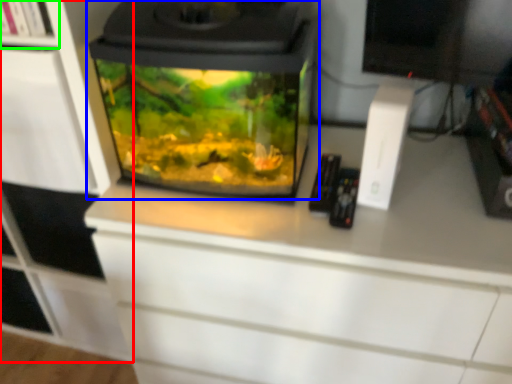
Question: Which is farther away from cabinetry (highlighted by a red box)? home appliance (highlighted by a blue box) or shelf (highlighted by a green box)?

Choices:
 (A) home appliance
 (B) shelf

Answer: (B)